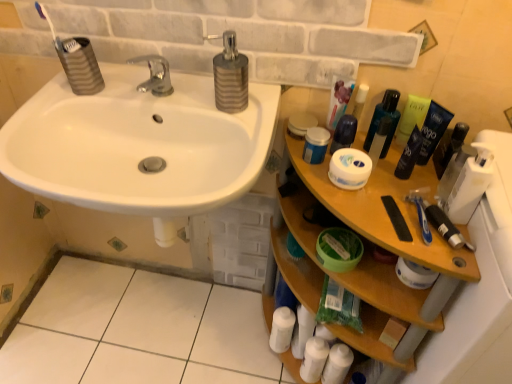
The height and width of the screenshot is (384, 512). I want to click on white tile at lower left, so click(x=138, y=331).

Describe the element at coordinates (155, 75) in the screenshot. I see `silver metallic faucet at center` at that location.

What do you see at coordinates (349, 168) in the screenshot? I see `white matte jar at center` at bounding box center [349, 168].

Where is `translucent plastic toothbrush at upper left, the 1th toothbrush when ordered from top to bottom`? translucent plastic toothbrush at upper left, the 1th toothbrush when ordered from top to bottom is located at coordinates (76, 60).

Find the location of a particular element. translucent plastic bottle at right, which is counted as the 7th mouthwash, starting from the left is located at coordinates (449, 146).

Identify the location of white matte jar at upper right, the third toiletry in the back-to-front sequence. Image resolution: width=512 pixels, height=384 pixels. (379, 140).

In order to face white matte jar at upper right, acting as the first toiletry starting from the top, should I rotate leftwards or rightwards?

You should look right and rotate roughly 16.356 degrees.

The width and height of the screenshot is (512, 384). What do you see at coordinates (421, 213) in the screenshot?
I see `blue plastic toothbrush at right, acting as the first toothbrush starting from the right` at bounding box center [421, 213].

The width and height of the screenshot is (512, 384). Identify the location of transparent plastic bottle at upper right, the 5th mouthwash when ordered from right to left. (381, 118).

In the scene shown: Is transparent plastic bottle at upper right, the 5th mouthwash when ordered from right to left, further to camera compared to white matte jar at upper right, acting as the first toiletry starting from the top?

Yes, it is behind white matte jar at upper right, acting as the first toiletry starting from the top.

From a real-world perspective, which is physically below, transparent plastic bottle at upper right, the 5th mouthwash when ordered from right to left, or white matte jar at upper right, the third toiletry in the back-to-front sequence?

transparent plastic bottle at upper right, the 5th mouthwash when ordered from right to left, from a real-world perspective.

Which is more to the left, transparent plastic bottle at upper right, the 5th mouthwash when ordered from right to left, or white matte jar at upper right, acting as the first toiletry starting from the top?

From the viewer's perspective, white matte jar at upper right, acting as the first toiletry starting from the top, appears more on the left side.

Consider the image. From their relative heights in the image, would you say transparent plastic bottle at upper right, which is the third mouthwash from left to right, is taller or shorter than white matte jar at upper right, which is the first toiletry in front-to-back order?

In the image, transparent plastic bottle at upper right, which is the third mouthwash from left to right, appears to be taller than white matte jar at upper right, which is the first toiletry in front-to-back order.

Between point (71, 63) and point (428, 190), which one is positioned behind?

The point (71, 63) is behind.

Is translucent plastic toothbrush at upper left, which is the 2th toothbrush from front to back, at the left side of blue plastic toothbrush at right, positioned as the first toothbrush in front-to-back order?

Indeed, translucent plastic toothbrush at upper left, which is the 2th toothbrush from front to back, is positioned on the left side of blue plastic toothbrush at right, positioned as the first toothbrush in front-to-back order.

From the image's perspective, is translucent plastic toothbrush at upper left, which is the 2th toothbrush from front to back, located above or below blue plastic toothbrush at right, acting as the second toothbrush starting from the left?

Based on their image positions, translucent plastic toothbrush at upper left, which is the 2th toothbrush from front to back, is located above blue plastic toothbrush at right, acting as the second toothbrush starting from the left.

Does translucent plastic toothbrush at upper left, marked as the 2th toothbrush in a bottom-to-top arrangement, have a smaller size compared to blue plastic toothbrush at right, which is counted as the second toothbrush, starting from the back?

Incorrect, translucent plastic toothbrush at upper left, marked as the 2th toothbrush in a bottom-to-top arrangement, is not smaller in size than blue plastic toothbrush at right, which is counted as the second toothbrush, starting from the back.

The width and height of the screenshot is (512, 384). I want to click on mouthwash that is the 4th one when counting backward from the blue plastic toothbrush at right, acting as the first toothbrush starting from the right, so click(315, 145).

From the image's perspective, does white matte jar at upper right, the 1th mouthwash positioned from the left, appear higher than blue plastic toothbrush at right, acting as the first toothbrush starting from the right?

Yes, from the image's perspective, white matte jar at upper right, the 1th mouthwash positioned from the left, is over blue plastic toothbrush at right, acting as the first toothbrush starting from the right.

How many degrees apart are the facing directions of white matte jar at upper right, which ranks as the seventh mouthwash in right-to-left order, and blue plastic toothbrush at right, acting as the first toothbrush starting from the right?

They differ by 95.6 degrees in their facing directions.

Who is bigger, white matte jar at upper right, the 1th mouthwash positioned from the left, or blue plastic toothbrush at right, acting as the first toothbrush starting from the right?

Bigger between the two is white matte jar at upper right, the 1th mouthwash positioned from the left.

How different are the orientations of white matte jar at upper right, placed as the 6th mouthwash when sorted from right to left, and dark blue plastic mouthwash at upper right, acting as the fourth mouthwash starting from the left, in degrees?

The facing directions of white matte jar at upper right, placed as the 6th mouthwash when sorted from right to left, and dark blue plastic mouthwash at upper right, acting as the fourth mouthwash starting from the left, are 74.6 degrees apart.

Looking at this image, does white matte jar at upper right, which appears as the second mouthwash when viewed from the left, lie behind dark blue plastic mouthwash at upper right, acting as the fourth mouthwash starting from the left?

Yes, the depth of white matte jar at upper right, which appears as the second mouthwash when viewed from the left, is greater than that of dark blue plastic mouthwash at upper right, acting as the fourth mouthwash starting from the left.

Consider the image. Does white matte jar at upper right, which appears as the second mouthwash when viewed from the left, have a greater height compared to dark blue plastic mouthwash at upper right, which is counted as the fourth mouthwash, starting from the right?

No.

Can you see white matte jar at upper right, placed as the 6th mouthwash when sorted from right to left, touching dark blue plastic mouthwash at upper right, which is counted as the fourth mouthwash, starting from the right?

No, white matte jar at upper right, placed as the 6th mouthwash when sorted from right to left, is not making contact with dark blue plastic mouthwash at upper right, which is counted as the fourth mouthwash, starting from the right.

From a real-world perspective, which is physically below, white matte jar at upper right, placed as the 6th mouthwash when sorted from right to left, or white matte bottle at lower center, which ranks as the 1th toiletry in left-to-right order?

white matte bottle at lower center, which ranks as the 1th toiletry in left-to-right order, from a real-world perspective.

From their relative heights in the image, would you say white matte jar at upper right, which appears as the second mouthwash when viewed from the left, is taller or shorter than white matte bottle at lower center, the third toiletry in the right-to-left sequence?

Clearly, white matte jar at upper right, which appears as the second mouthwash when viewed from the left, is shorter compared to white matte bottle at lower center, the third toiletry in the right-to-left sequence.

Is point (349, 136) in front of point (272, 324)?

Yes.

Between white matte jar at upper right, which appears as the second mouthwash when viewed from the left, and white matte bottle at lower center, which ranks as the 1th toiletry in left-to-right order, which one appears on the left side from the viewer's perspective?

From the viewer's perspective, white matte bottle at lower center, which ranks as the 1th toiletry in left-to-right order, appears more on the left side.

Is transparent plastic bottle at upper right, the 5th mouthwash when ordered from right to left, at the right side of white matte tube at upper right?

Correct, you'll find transparent plastic bottle at upper right, the 5th mouthwash when ordered from right to left, to the right of white matte tube at upper right.

Which is behind, point (385, 140) or point (332, 96)?

The point (385, 140) is farther from the camera.

Which of these two, transparent plastic bottle at upper right, the 5th mouthwash when ordered from right to left, or white matte tube at upper right, is thinner?

transparent plastic bottle at upper right, the 5th mouthwash when ordered from right to left.

Looking at this image, from the image's perspective, does translucent plastic bottle at right, which is counted as the 7th mouthwash, starting from the left, appear higher than silver metallic faucet at center?

No, from the image's perspective, translucent plastic bottle at right, which is counted as the 7th mouthwash, starting from the left, is not above silver metallic faucet at center.

Can you confirm if translucent plastic bottle at right, the first mouthwash from the right, is wider than silver metallic faucet at center?

In fact, translucent plastic bottle at right, the first mouthwash from the right, might be narrower than silver metallic faucet at center.

Who is smaller, translucent plastic bottle at right, which is counted as the 7th mouthwash, starting from the left, or silver metallic faucet at center?

translucent plastic bottle at right, which is counted as the 7th mouthwash, starting from the left.

In the scene shown: Which of these two, translucent plastic bottle at right, the first mouthwash from the right, or silver metallic faucet at center, stands shorter?

With less height is silver metallic faucet at center.

The height and width of the screenshot is (384, 512). I want to click on toiletry in front of the transparent plastic bottle at upper right, the 5th mouthwash when ordered from right to left, so pyautogui.click(x=379, y=140).

Find the location of a particular element. toothbrush above the blue plastic toothbrush at right, positioned as the first toothbrush in front-to-back order (from the image's perspective) is located at coordinates (76, 60).

From the image, which object appears to be farther from white matte jar at upper right, which is the first toiletry in front-to-back order, white matte jar at upper right, which appears as the second mouthwash when viewed from the left, or translucent plastic bottle at right, the first mouthwash from the right?

Based on the image, translucent plastic bottle at right, the first mouthwash from the right, appears to be further to white matte jar at upper right, which is the first toiletry in front-to-back order.

Based on their spatial positions, is wooden shelf at right or white glossy sink at upper left closer to silver metallic faucet at center?

white glossy sink at upper left lies closer to silver metallic faucet at center than the other object.

Looking at this image, when comparing their distances from translucent plastic bottle at right, which is counted as the 7th mouthwash, starting from the left, does dark blue plastic mouthwash at upper right, which is counted as the fourth mouthwash, starting from the right, or white matte jar at upper right, which ranks as the seventh mouthwash in right-to-left order, seem closer?

dark blue plastic mouthwash at upper right, which is counted as the fourth mouthwash, starting from the right, is closer to translucent plastic bottle at right, which is counted as the 7th mouthwash, starting from the left.

Considering their positions, is blue plastic toothbrush at right, which is counted as the second toothbrush, starting from the back, positioned closer to dark blue plastic tube at upper right, marked as the second mouthwash in a right-to-left arrangement, than white matte jar at center?

Among the two, blue plastic toothbrush at right, which is counted as the second toothbrush, starting from the back, is located nearer to dark blue plastic tube at upper right, marked as the second mouthwash in a right-to-left arrangement.

Looking at the image, which one is located closer to translucent plastic toothbrush at upper left, the 1th toothbrush when ordered from back to front, transparent plastic bottle at upper right, the 5th mouthwash when ordered from right to left, or blue plastic toothbrush at right, the 2th toothbrush positioned from the top?

Among the two, transparent plastic bottle at upper right, the 5th mouthwash when ordered from right to left, is located nearer to translucent plastic toothbrush at upper left, the 1th toothbrush when ordered from back to front.

Estimate the real-world distances between objects in this image. Which object is closer to white glossy sink at upper left, silver metallic soap dispenser at upper center or dark blue plastic tube at upper right, marked as the second mouthwash in a right-to-left arrangement?

silver metallic soap dispenser at upper center lies closer to white glossy sink at upper left than the other object.

When comparing their distances from white matte jar at upper right, which appears as the second mouthwash when viewed from the left, does blue plastic toothbrush at right, acting as the first toothbrush starting from the right, or dark blue plastic tube at upper right, marked as the second mouthwash in a right-to-left arrangement, seem closer?

dark blue plastic tube at upper right, marked as the second mouthwash in a right-to-left arrangement.

When comparing their distances from white matte jar at center, does wooden shelf at right or white matte jar at upper right, which is the first toiletry in front-to-back order, seem further?

The object further to white matte jar at center is wooden shelf at right.

This screenshot has width=512, height=384. I want to click on toilet paper between green plastic bottle at upper right, the 3th mouthwash in the right-to-left sequence, and wooden shelf at right vertically, so click(x=349, y=168).

The width and height of the screenshot is (512, 384). In order to click on sink between translucent plastic toothbrush at upper left, which appears as the 2th toothbrush when viewed from the right, and white tile at lower left from top to bottom in this screenshot , I will do [x=138, y=144].

Identify the location of toothpaste between white matte jar at upper right, the 1th mouthwash positioned from the left, and green plastic bottle at upper right, the 3th mouthwash in the right-to-left sequence, in the horizontal direction. The height and width of the screenshot is (384, 512). (338, 100).

Find the location of `toothbrush between white matte jar at center and white matte bottle at lower center, placed as the 3th toiletry when sorted from front to back, in the up-down direction`. toothbrush between white matte jar at center and white matte bottle at lower center, placed as the 3th toiletry when sorted from front to back, in the up-down direction is located at coordinates (421, 213).